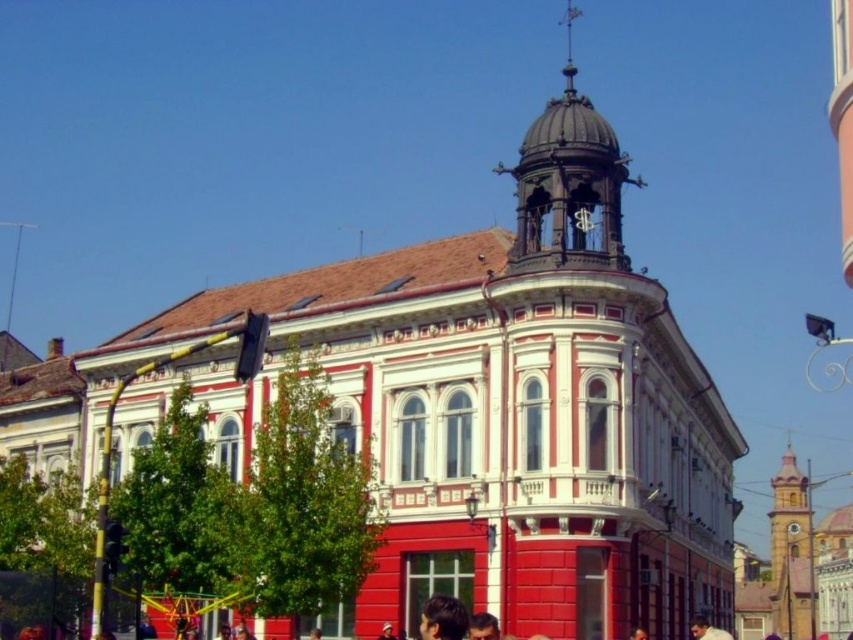
Question: Which object is farther from the camera taking this photo?

Choices:
 (A) dark brown hair at lower center
 (B) polished brass bell tower at upper center

Answer: (B)

Question: Estimate the real-world distances between objects in this image. Which object is farther from the dark brown hair at lower center?

Choices:
 (A) brick clock tower at right
 (B) polished brass bell tower at upper center

Answer: (A)

Question: Is brick clock tower at right to the right of dark brown hair at lower center from the viewer's perspective?

Choices:
 (A) no
 (B) yes

Answer: (B)

Question: Is polished brass bell tower at upper center wider than brick clock tower at right?

Choices:
 (A) yes
 (B) no

Answer: (B)

Question: Does brick clock tower at right appear under dark brown hair at lower center?

Choices:
 (A) no
 (B) yes

Answer: (B)

Question: Which of the following is the closest to the observer?

Choices:
 (A) (515, 173)
 (B) (801, 472)

Answer: (A)